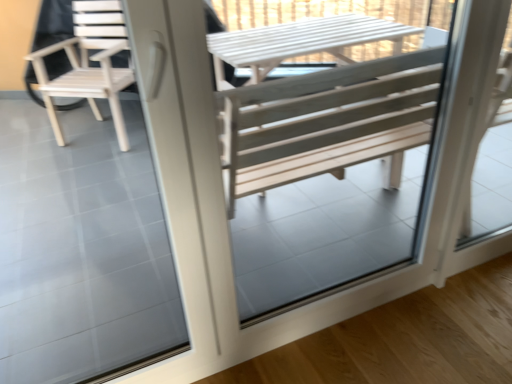
This screenshot has height=384, width=512. Describe the element at coordinates (325, 174) in the screenshot. I see `transparent glass door at center` at that location.

Where is `transparent glass door at center`? Image resolution: width=512 pixels, height=384 pixels. transparent glass door at center is located at coordinates (325, 174).

The width and height of the screenshot is (512, 384). What are the coordinates of `transparent glass door at center` in the screenshot? It's located at (325, 174).